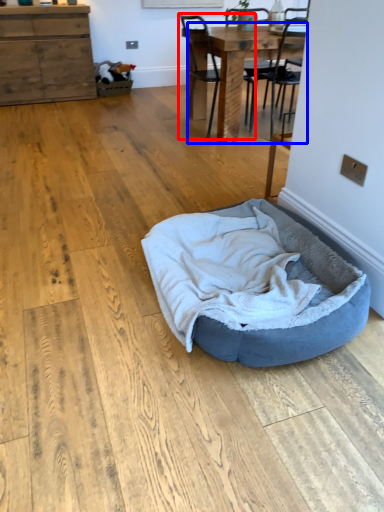
Question: Which object is further to the camera taking this photo, chair (highlighted by a red box) or table (highlighted by a blue box)?

Choices:
 (A) chair
 (B) table

Answer: (A)